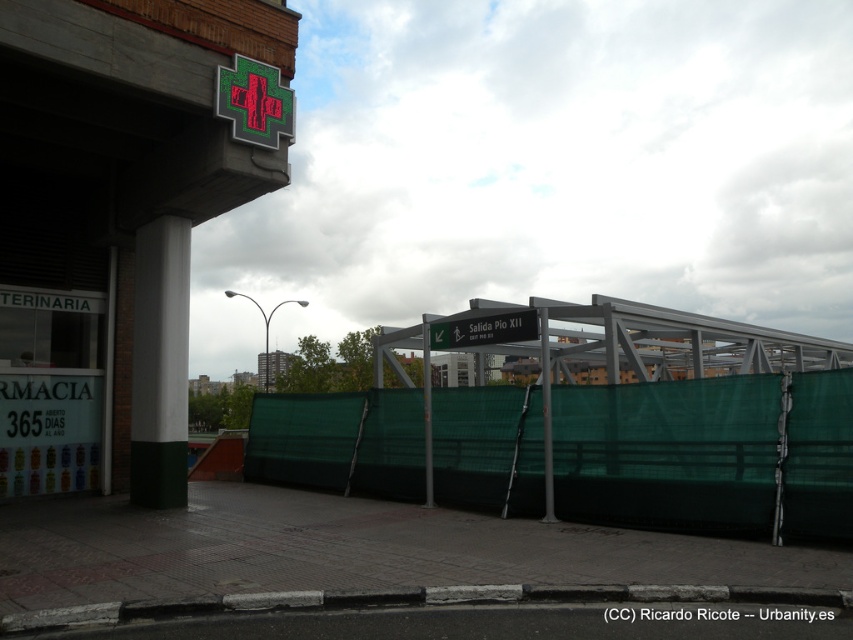
You are a delivery person trying to locate the pharmacy in the image. The construction site is on the right, and the pharmacy is on the left. Where exactly is the green matte cross at upper center situated in relation to the pharmacy and construction site?

The green matte cross at upper center is located at point (254, 102), which is on the left side of the image where the pharmacy is situated, not near the construction site on the right.

You are a delivery person who needs to attach a package to the shorter object between the green matte cross at upper center and the green metallic signpost at center. Which object should you choose?

The green matte cross at upper center is not as tall as the green metallic signpost at center, so you should attach the package to the green matte cross at upper center since it is shorter.